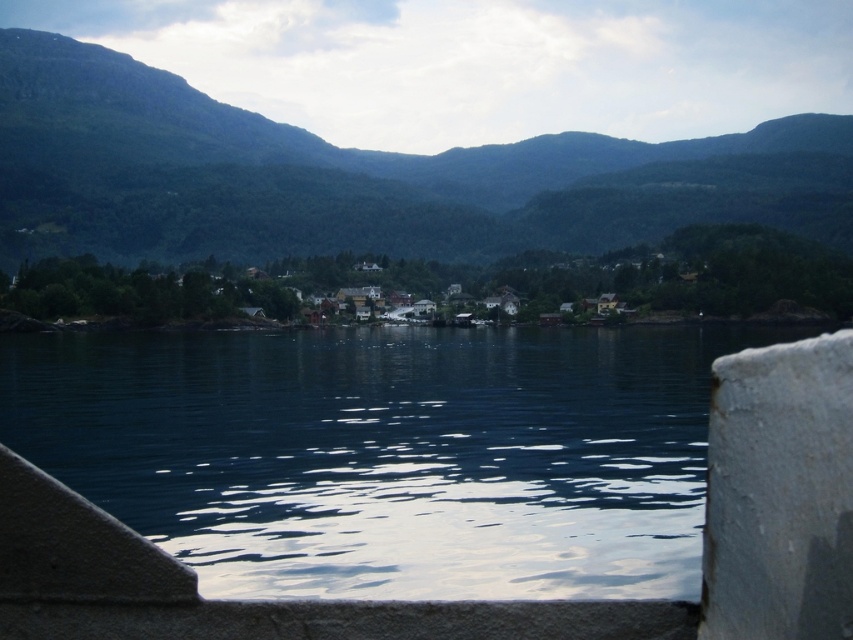
Question: From the image, what is the correct spatial relationship of dark blue water at center in relation to green forested mountain at upper center?

Choices:
 (A) above
 (B) below

Answer: (B)

Question: Which of the following is the closest to the observer?

Choices:
 (A) (448, 496)
 (B) (125, 192)

Answer: (A)

Question: Is dark blue water at center positioned in front of green forested mountain at upper center?

Choices:
 (A) no
 (B) yes

Answer: (B)

Question: Does dark blue water at center have a lesser width compared to green forested mountain at upper center?

Choices:
 (A) no
 (B) yes

Answer: (B)